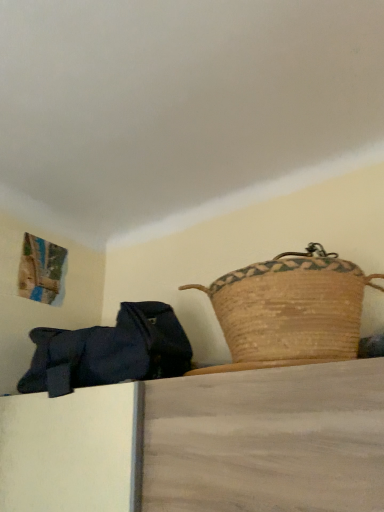
Consider the image. What is the approximate width of brown woven picnic basket at upper right?

brown woven picnic basket at upper right is 18.23 inches in width.

What do you see at coordinates (291, 308) in the screenshot? I see `brown woven picnic basket at upper right` at bounding box center [291, 308].

Where is `brown woven picnic basket at upper right`? Image resolution: width=384 pixels, height=512 pixels. brown woven picnic basket at upper right is located at coordinates (291, 308).

At what (x,y) coordinates should I click in order to perform the action: click on dark blue fabric bag at left. Please return your answer as a coordinate pair (x, y). This screenshot has height=512, width=384. Looking at the image, I should click on (110, 351).

What do you see at coordinates (110, 351) in the screenshot? I see `dark blue fabric bag at left` at bounding box center [110, 351].

Locate an element on the screen. The image size is (384, 512). brown woven picnic basket at upper right is located at coordinates (291, 308).

Considering the positions of objects brown woven picnic basket at upper right and dark blue fabric bag at left in the image provided, who is more to the right, brown woven picnic basket at upper right or dark blue fabric bag at left?

brown woven picnic basket at upper right is more to the right.

Is brown woven picnic basket at upper right closer to the viewer compared to dark blue fabric bag at left?

Yes, it is in front of dark blue fabric bag at left.

Is point (234, 288) more distant than point (71, 382)?

No, (234, 288) is in front of (71, 382).

From the image's perspective, is brown woven picnic basket at upper right located above or below dark blue fabric bag at left?

Answer: From the image's perspective, brown woven picnic basket at upper right appears above dark blue fabric bag at left.

From a real-world perspective, is brown woven picnic basket at upper right positioned above or below dark blue fabric bag at left?

brown woven picnic basket at upper right is situated higher than dark blue fabric bag at left in the real world.

Which object is wider, brown woven picnic basket at upper right or dark blue fabric bag at left?

Wider between the two is brown woven picnic basket at upper right.

Is brown woven picnic basket at upper right taller than dark blue fabric bag at left?

Incorrect, the height of brown woven picnic basket at upper right is not larger of that of dark blue fabric bag at left.

Who is smaller, brown woven picnic basket at upper right or dark blue fabric bag at left?

With smaller size is brown woven picnic basket at upper right.

Is brown woven picnic basket at upper right positioned beyond the bounds of dark blue fabric bag at left?

brown woven picnic basket at upper right lies outside dark blue fabric bag at left's area.

Is brown woven picnic basket at upper right beside dark blue fabric bag at left?

No, brown woven picnic basket at upper right is not with dark blue fabric bag at left.

Is brown woven picnic basket at upper right oriented towards dark blue fabric bag at left?

No.

How many degrees apart are the facing directions of brown woven picnic basket at upper right and dark blue fabric bag at left?

They differ by 1.21 degrees in their facing directions.

Find the location of `handbag that is below the brown woven picnic basket at upper right (from the image's perspective)`. handbag that is below the brown woven picnic basket at upper right (from the image's perspective) is located at coordinates (110, 351).

Considering the relative positions of dark blue fabric bag at left and brown woven picnic basket at upper right in the image provided, is dark blue fabric bag at left to the left of brown woven picnic basket at upper right from the viewer's perspective?

Indeed, dark blue fabric bag at left is positioned on the left side of brown woven picnic basket at upper right.

Is dark blue fabric bag at left in front of brown woven picnic basket at upper right?

That is False.

Considering the positions of point (57, 394) and point (261, 300), is point (57, 394) closer or farther from the camera than point (261, 300)?

Point (57, 394) appears to be farther away from the viewer than point (261, 300).

From the image's perspective, is dark blue fabric bag at left over brown woven picnic basket at upper right?

No, from the image's perspective, dark blue fabric bag at left is not above brown woven picnic basket at upper right.

From a real-world perspective, is dark blue fabric bag at left positioned above or below brown woven picnic basket at upper right?

dark blue fabric bag at left is situated lower than brown woven picnic basket at upper right in the real world.

Which of these two, dark blue fabric bag at left or brown woven picnic basket at upper right, is thinner?

dark blue fabric bag at left.

Can you confirm if dark blue fabric bag at left is shorter than brown woven picnic basket at upper right?

In fact, dark blue fabric bag at left may be taller than brown woven picnic basket at upper right.

Which of these two, dark blue fabric bag at left or brown woven picnic basket at upper right, is bigger?

dark blue fabric bag at left.

Can we say dark blue fabric bag at left lies outside brown woven picnic basket at upper right?

Yes, dark blue fabric bag at left is located beyond the bounds of brown woven picnic basket at upper right.

Is dark blue fabric bag at left touching brown woven picnic basket at upper right?

They are not placed beside each other.

Is dark blue fabric bag at left turned away from brown woven picnic basket at upper right?

No.

Where is `handbag that appears on the left of brown woven picnic basket at upper right`? This screenshot has height=512, width=384. handbag that appears on the left of brown woven picnic basket at upper right is located at coordinates (110, 351).

The height and width of the screenshot is (512, 384). Find the location of `picnic basket in front of the dark blue fabric bag at left`. picnic basket in front of the dark blue fabric bag at left is located at coordinates (291, 308).

Identify the location of handbag located on the left of brown woven picnic basket at upper right. The width and height of the screenshot is (384, 512). (110, 351).